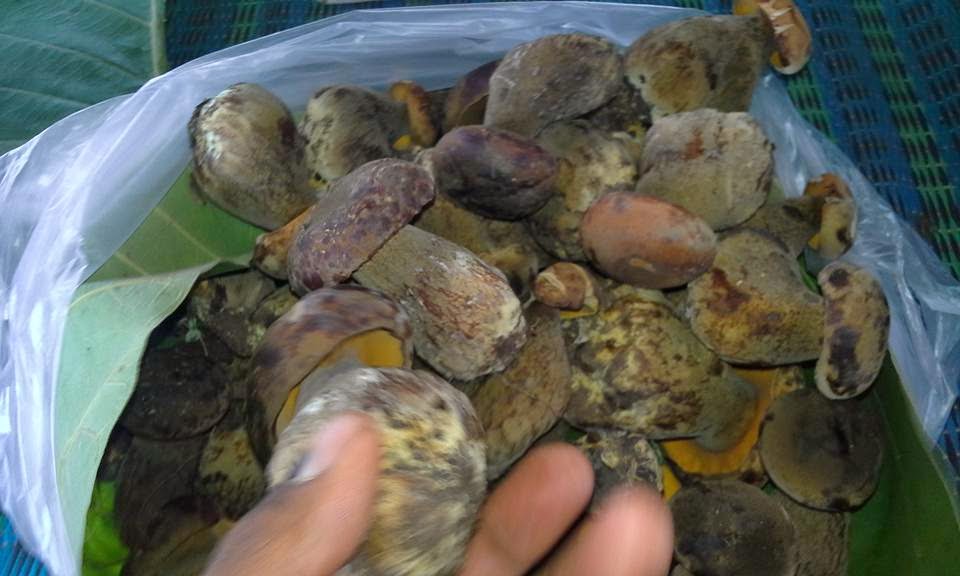
Identify the location of blanket. This screenshot has height=576, width=960. (189, 25).